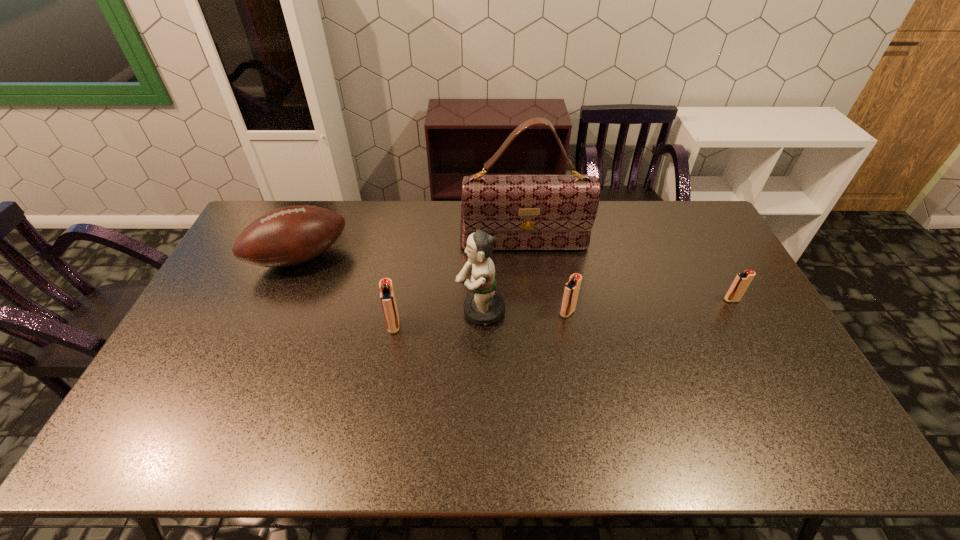
Identify the location of vacant space that satisfies the following two spatial constraints: 1. on the front of the handbag with the clasp; 2. on the left side of the farthest igniter. The height and width of the screenshot is (540, 960). (530, 300).